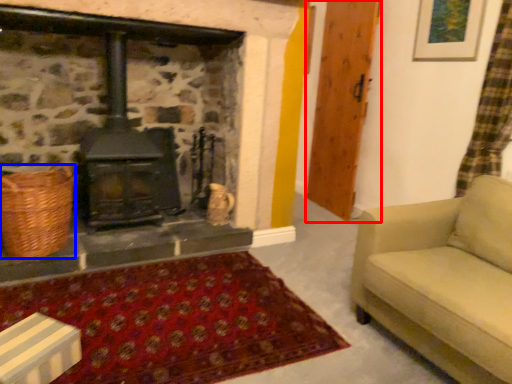
Question: Among these objects, which one is nearest to the camera, wood (highlighted by a red box) or basket (highlighted by a blue box)?

Choices:
 (A) wood
 (B) basket

Answer: (B)